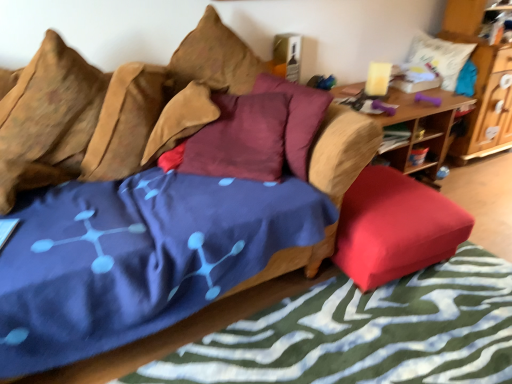
Find the location of a particular element. This screenshot has width=512, height=384. free region under blue fabric bed frame at lower left (from a real-world perspective) is located at coordinates (405, 335).